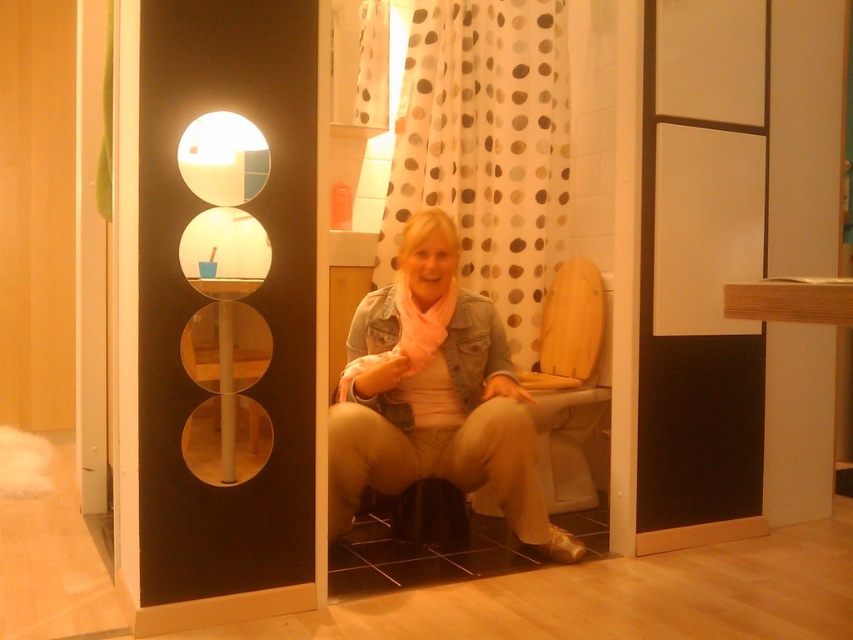
Question: Is white polka dot fabric at upper center wider than denim jacket at center?

Choices:
 (A) yes
 (B) no

Answer: (A)

Question: Is denim jacket at center smaller than wooden at center?

Choices:
 (A) yes
 (B) no

Answer: (B)

Question: Which point appears farthest from the camera in this image?

Choices:
 (A) (498, 16)
 (B) (566, 460)
 (C) (416, 392)

Answer: (A)

Question: Which point appears farthest from the camera in this image?

Choices:
 (A) (459, 368)
 (B) (425, 33)
 (C) (564, 458)

Answer: (B)

Question: Can you confirm if denim jacket at center is positioned below wooden at center?

Choices:
 (A) yes
 (B) no

Answer: (A)

Question: Which of the following is the closest to the observer?

Choices:
 (A) white polka dot fabric at upper center
 (B) denim jacket at center
 (C) wooden at center

Answer: (B)